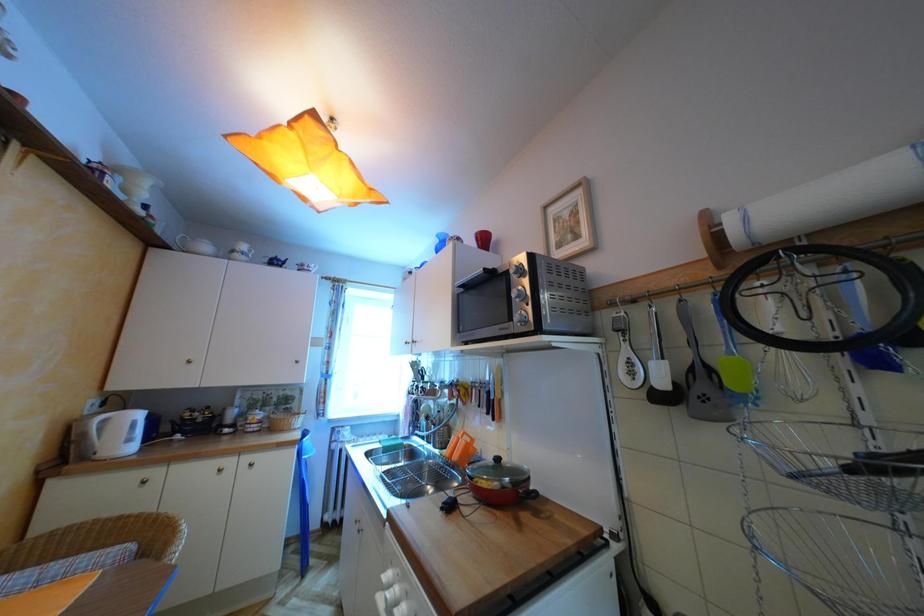
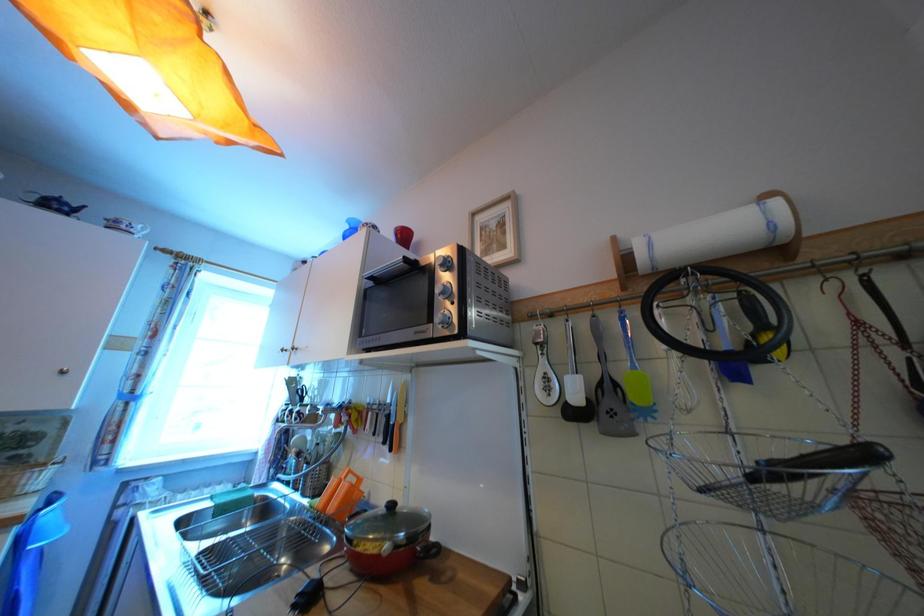
Question: The images are taken continuously from a first-person perspective. In which direction is your viewpoint rotating?

Choices:
 (A) Left
 (B) Right
 (C) Up
 (D) Down

Answer: (B)